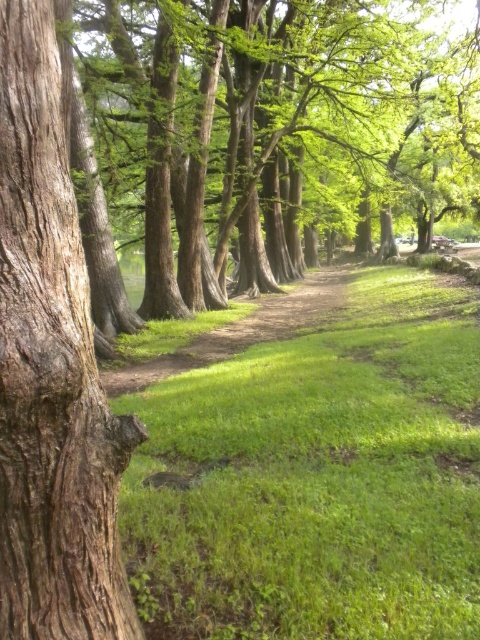
You are standing at the center of the dirt path in the park. You want to walk to the brown rough bark tree trunk at left. Which direction should you walk to reach it?

The brown rough bark tree trunk at left is located at point 0.578 on the x axis and 0.106 on the y axis. Since you are at the center of the dirt path, you should walk towards the left direction to reach the brown rough bark tree trunk at left.

You are standing on the dirt path in the park and see the green grassy at center and the green rough bark tree at center. Which object is closer to you?

The green grassy at center is closer to you because it is in front of the green rough bark tree at center.

You are a hiker who wants to cross the dirt path at center. There is a brown rough bark tree trunk at left blocking your way. Can you walk around it easily?

The brown rough bark tree trunk at left has a lesser height compared to dirt path at center, so the tree trunk is shorter than the path. Since the tree trunk is shorter, it might not block your way, so you can walk around it easily.